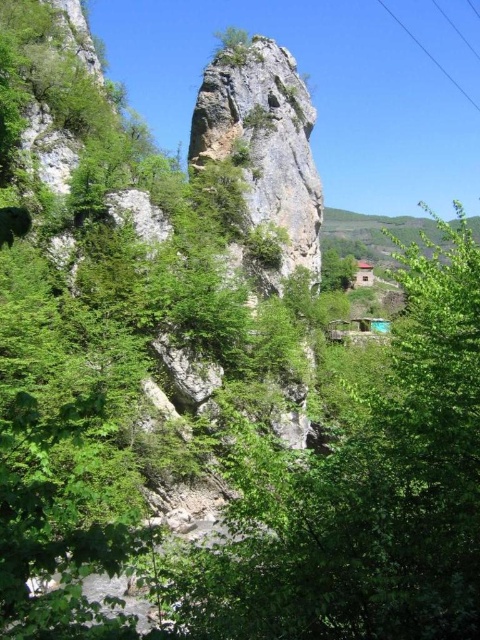
Who is higher up, green leafy tree at center or rough stone rock at center?

rough stone rock at center is higher up.

Does point (359, 525) lie behind point (271, 93)?

That is False.

Locate an element on the screen. green leafy tree at center is located at coordinates click(x=365, y=493).

Can you confirm if rough stone rock at center is smaller than clear plastic power lines at upper right?

No, rough stone rock at center is not smaller than clear plastic power lines at upper right.

Between point (273, 276) and point (450, 80), which one is positioned behind?

Point (450, 80)

Identify the location of rough stone rock at center. This screenshot has height=640, width=480. (264, 145).

Where is `rough stone rock at center`? rough stone rock at center is located at coordinates (264, 145).

This screenshot has height=640, width=480. Describe the element at coordinates (365, 493) in the screenshot. I see `green leafy tree at center` at that location.

Does green leafy tree at center appear on the left side of clear plastic power lines at upper right?

Yes, green leafy tree at center is to the left of clear plastic power lines at upper right.

Where is `green leafy tree at center`? green leafy tree at center is located at coordinates (365, 493).